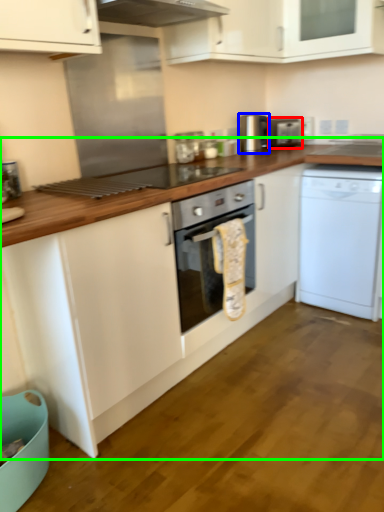
Question: Considering the real-world distances, which object is farthest from appliance (highlighted by a red box)? appliance (highlighted by a blue box) or countertop (highlighted by a green box)?

Choices:
 (A) appliance
 (B) countertop

Answer: (B)